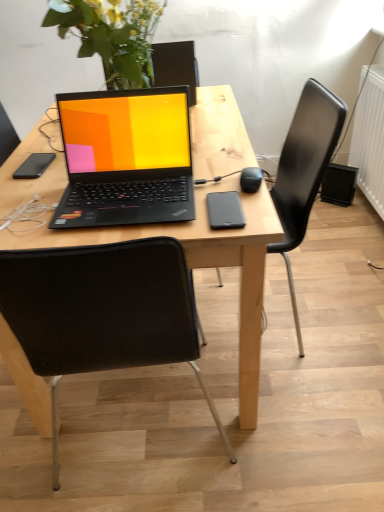
This screenshot has width=384, height=512. I want to click on free space that is to the left of black matte laptop at center, so click(33, 202).